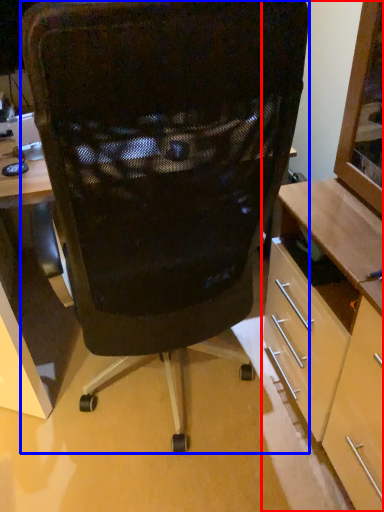
Question: Which object is further to the camera taking this photo, cabinetry (highlighted by a red box) or chair (highlighted by a blue box)?

Choices:
 (A) cabinetry
 (B) chair

Answer: (B)